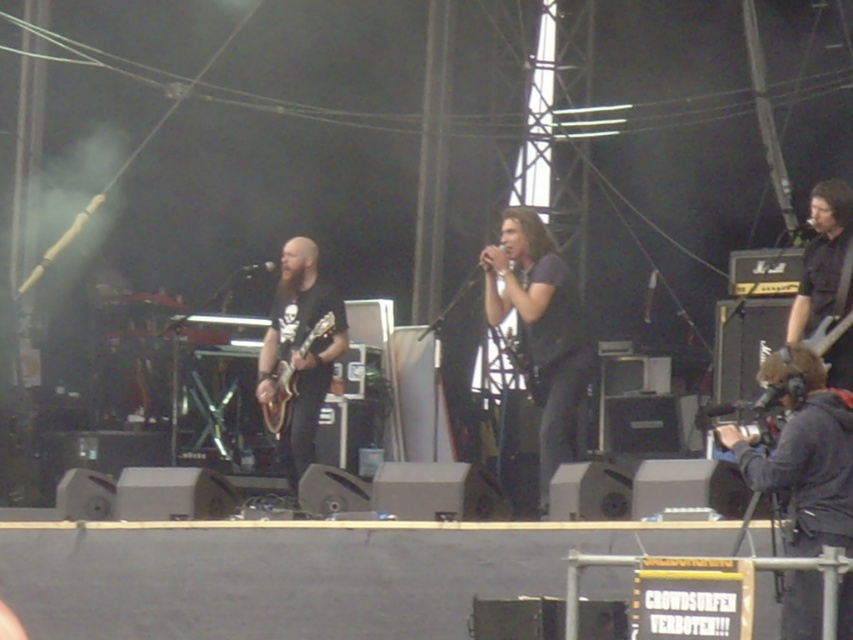
You are a photographer at the concert and want to capture both the guitarist and the singer in your shot. The guitarist is at point (x=305, y=460) and the singer is at point (x=820, y=186). Since the stage is crowded, you need to adjust your focus. Which point should you focus on to ensure the closer subject is sharp?

You should focus on point (x=820, y=186) because it is closer to the camera than point (x=305, y=460), ensuring the singer is in focus.

You are a stagehand responsible for setting up the equipment. You need to place a large amplifier that requires a minimum of 1.2 meters of space. Based on the image, which guitar, the black matte guitar at center or the black matte guitar at right, would you choose to position the amplifier next to, considering their sizes?

The black matte guitar at center is bigger than the black matte guitar at right. Therefore, positioning the amplifier next to the black matte guitar at center would provide sufficient space since it is larger and likely has more room around it to accommodate the amplifier requiring 1.2 meters of space.

You are standing in the audience at the outdoor concert venue. You want to take a photo of the black matte guitar at center from where you are standing. Considering the distance, will you need a zoom lens to capture the entire guitar in your photo?

The black matte guitar at center is 49.17 feet away from the viewer. To capture the entire guitar in a photo from that distance, a zoom lens would be necessary to ensure clarity and framing.